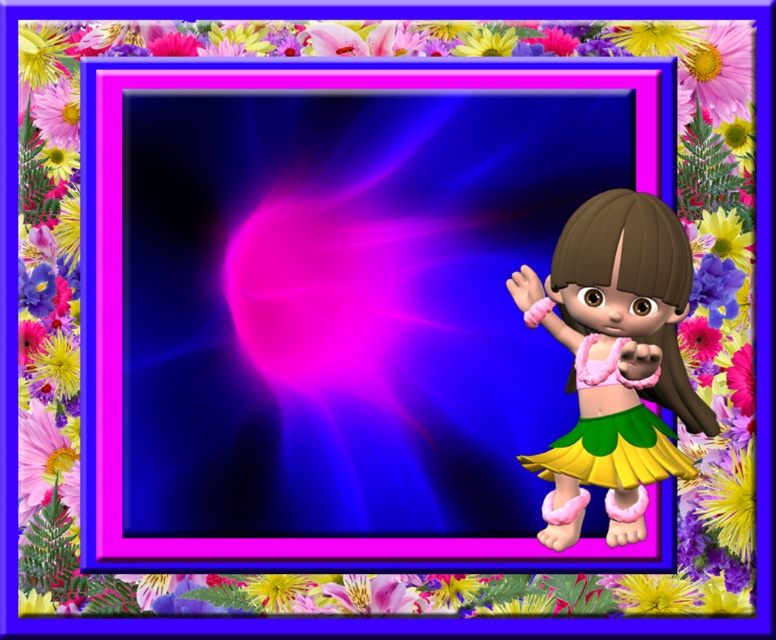
Is shiny pink fabric skirt at right above green fabric skirt at lower right?

Correct, shiny pink fabric skirt at right is located above green fabric skirt at lower right.

Which is in front, point (577, 376) or point (645, 456)?

Point (645, 456) is in front.

Describe the element at coordinates (617, 342) in the screenshot. I see `shiny pink fabric skirt at right` at that location.

Locate an element on the screen. shiny pink fabric skirt at right is located at coordinates (617, 342).